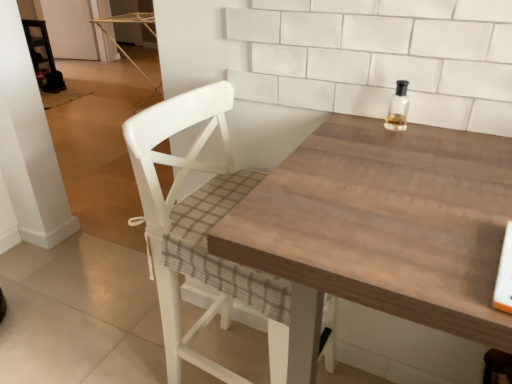
This screenshot has height=384, width=512. Identify the location of vacant area that is situated to the right of clear glass bottle at upper right. (456, 137).